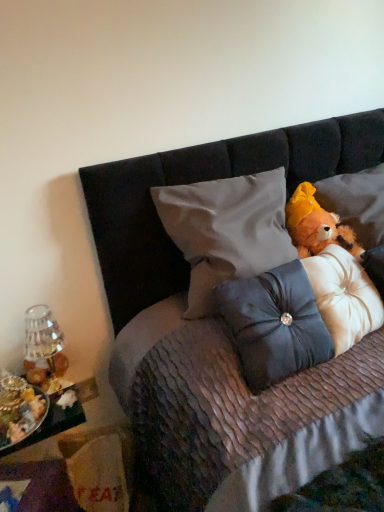
Question: Could you tell me if transparent glass vase at left is facing satin gray pillow at center, positioned as the 1th pillow in left-to-right order?

Choices:
 (A) yes
 (B) no

Answer: (B)

Question: Can you confirm if transparent glass vase at left is shorter than satin gray pillow at center, acting as the 3th pillow starting from the right?

Choices:
 (A) no
 (B) yes

Answer: (B)

Question: Does transparent glass vase at left have a smaller size compared to satin gray pillow at center, acting as the 3th pillow starting from the right?

Choices:
 (A) no
 (B) yes

Answer: (B)

Question: Is transparent glass vase at left to the left of satin gray pillow at center, positioned as the 1th pillow in left-to-right order, from the viewer's perspective?

Choices:
 (A) no
 (B) yes

Answer: (B)

Question: Considering the relative sizes of transparent glass vase at left and satin gray pillow at center, acting as the 3th pillow starting from the right, in the image provided, is transparent glass vase at left taller than satin gray pillow at center, acting as the 3th pillow starting from the right,?

Choices:
 (A) yes
 (B) no

Answer: (B)

Question: Looking at their shapes, would you say metallic silver tray at lower left is wider or thinner than metallic silver tray at lower left?

Choices:
 (A) wide
 (B) thin

Answer: (B)

Question: Considering their positions, is metallic silver tray at lower left located in front of or behind metallic silver tray at lower left?

Choices:
 (A) front
 (B) behind

Answer: (B)

Question: From the image's perspective, is metallic silver tray at lower left positioned above or below metallic silver tray at lower left?

Choices:
 (A) above
 (B) below

Answer: (A)

Question: Looking at the image, does metallic silver tray at lower left seem bigger or smaller compared to metallic silver tray at lower left?

Choices:
 (A) big
 (B) small

Answer: (B)

Question: In terms of width, does satin dark blue pillow at center, the 2th pillow viewed from the left, look wider or thinner when compared to transparent glass vase at left?

Choices:
 (A) thin
 (B) wide

Answer: (B)

Question: Looking at the image, does satin dark blue pillow at center, the 2th pillow viewed from the left, seem bigger or smaller compared to transparent glass vase at left?

Choices:
 (A) small
 (B) big

Answer: (B)

Question: From the image's perspective, relative to transparent glass vase at left, is satin dark blue pillow at center, the second pillow from the right, above or below?

Choices:
 (A) below
 (B) above

Answer: (B)

Question: Is point (319, 335) positioned closer to the camera than point (43, 340)?

Choices:
 (A) closer
 (B) farther

Answer: (A)

Question: Considering the relative positions of metallic silver tray at lower left and satin gray pillow at center, acting as the 3th pillow starting from the right, in the image provided, is metallic silver tray at lower left to the left or to the right of satin gray pillow at center, acting as the 3th pillow starting from the right,?

Choices:
 (A) left
 (B) right

Answer: (A)

Question: From the image's perspective, is metallic silver tray at lower left positioned above or below satin gray pillow at center, acting as the 3th pillow starting from the right?

Choices:
 (A) above
 (B) below

Answer: (B)